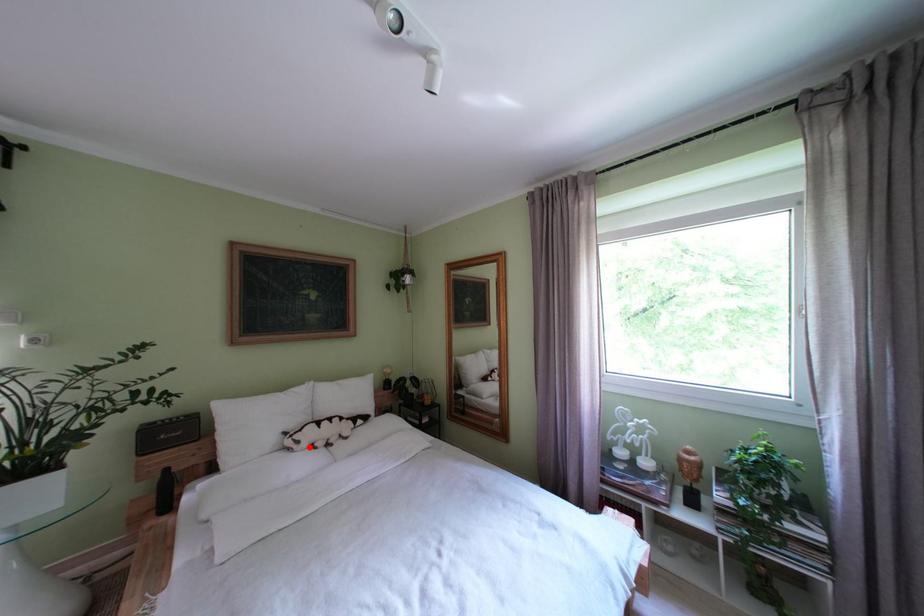
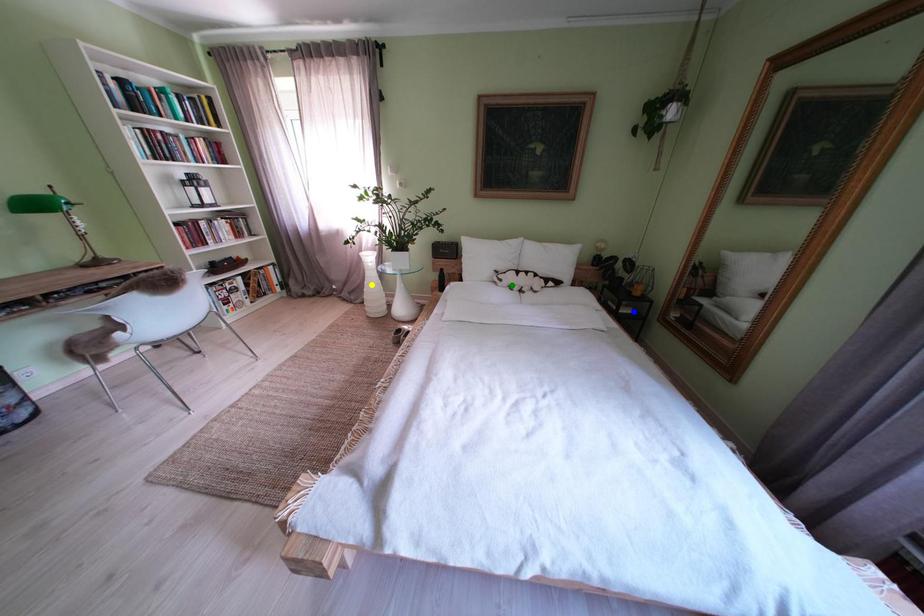
Question: I am providing you with two images of the same scene from different viewpoints. A red point is marked on the first image. You are given multiple points on the second image. Can you choose the point in image 2 that corresponds to the point in image 1?

Choices:
 (A) green point
 (B) yellow point
 (C) blue point

Answer: (A)